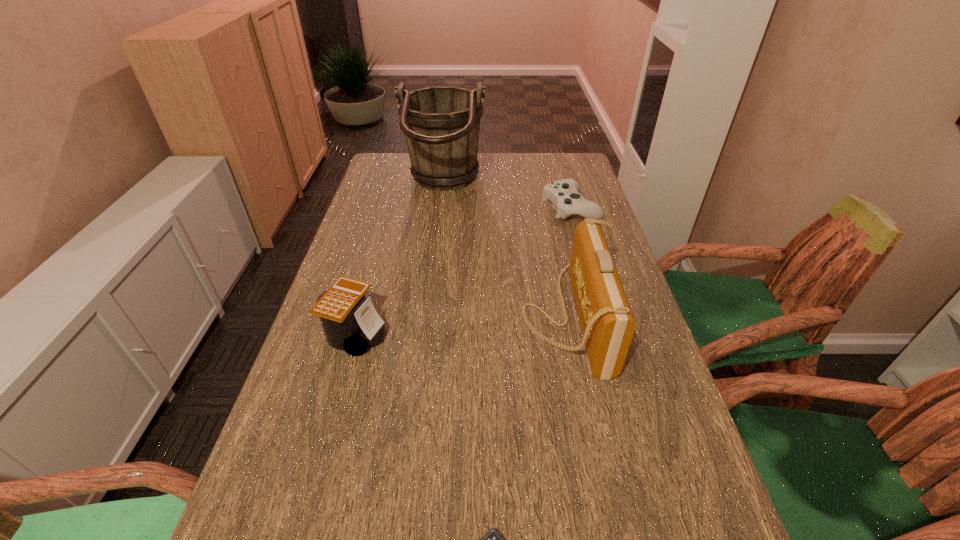
You are a GUI agent. You are given a task and a screenshot of the screen. Output one action in this format:
    pyautogui.click(x=<x>, y=<y>)
    Task: Click on the tallest object
    The height and width of the screenshot is (540, 960).
    Given the screenshot: What is the action you would take?
    pyautogui.click(x=441, y=124)

At what (x,y) coordinates should I click in order to perform the action: click on the fourth shortest object. Please return your answer as a coordinate pair (x, y). Looking at the image, I should click on (607, 323).

Where is `the left calculator`? The width and height of the screenshot is (960, 540). the left calculator is located at coordinates (350, 322).

Where is `the taller calculator`? The width and height of the screenshot is (960, 540). the taller calculator is located at coordinates (350, 322).

You are a GUI agent. You are given a task and a screenshot of the screen. Output one action in this format:
    pyautogui.click(x=<x>, y=<y>)
    Task: Click on the control
    This screenshot has width=960, height=540.
    Given the screenshot: What is the action you would take?
    pyautogui.click(x=564, y=195)

Locate an element on the screen. This screenshot has height=540, width=960. vacant area situated on the handle side of the tallest object is located at coordinates (508, 185).

Find the location of a particular element. This screenshot has width=960, height=540. free location located 0.200m on the decorative side of the fourth shortest object is located at coordinates (440, 317).

Identify the location of free space located 0.250m on the decorative side of the fourth shortest object. (420, 317).

Locate an element on the screen. vacant space located on the decorative side of the fourth shortest object is located at coordinates (502, 317).

I want to click on vacant space located 0.320m on the front of the taller calculator, so [x=306, y=509].